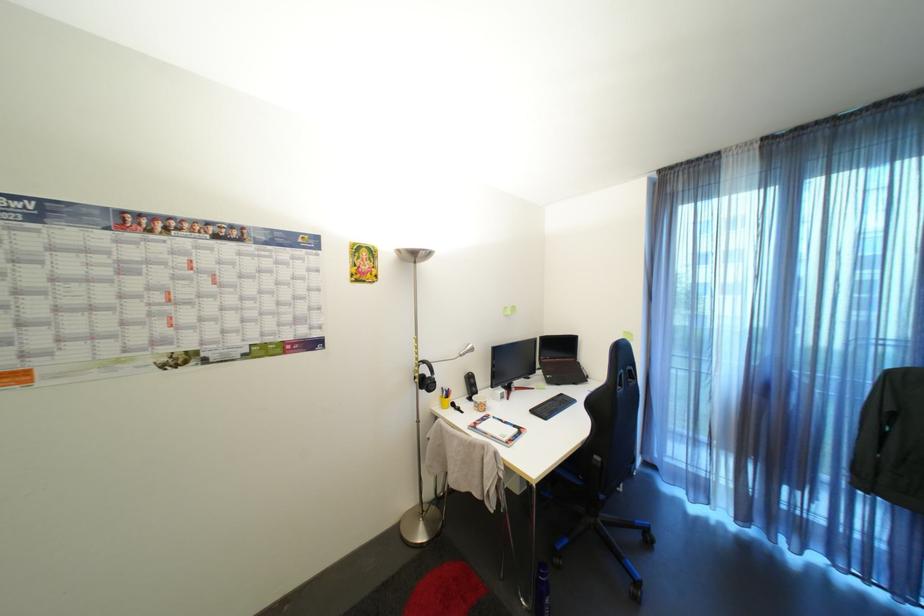
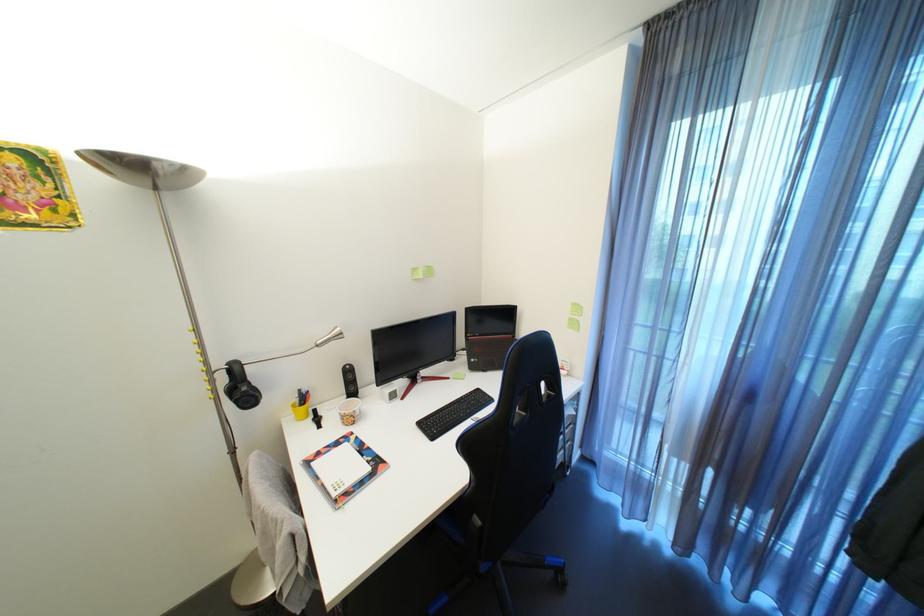
Question: How did the camera likely rotate?

Choices:
 (A) Left
 (B) Right
 (C) Up
 (D) Down

Answer: (D)